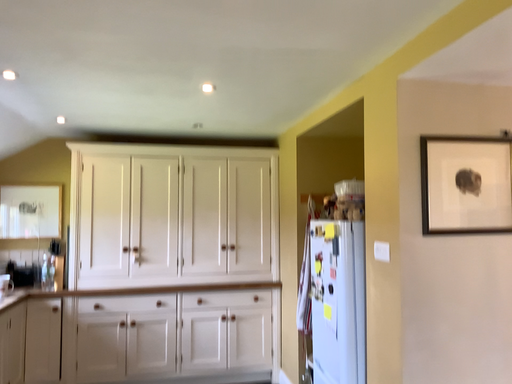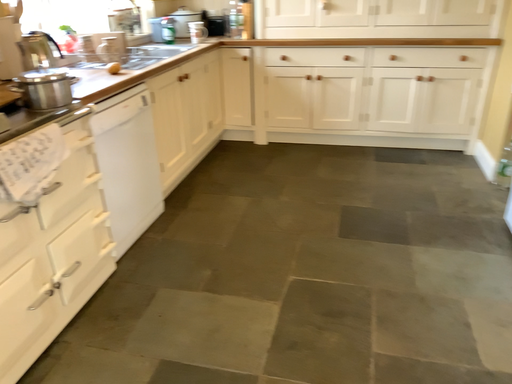
Question: How did the camera likely rotate when shooting the video?

Choices:
 (A) rotated upward
 (B) rotated downward

Answer: (B)